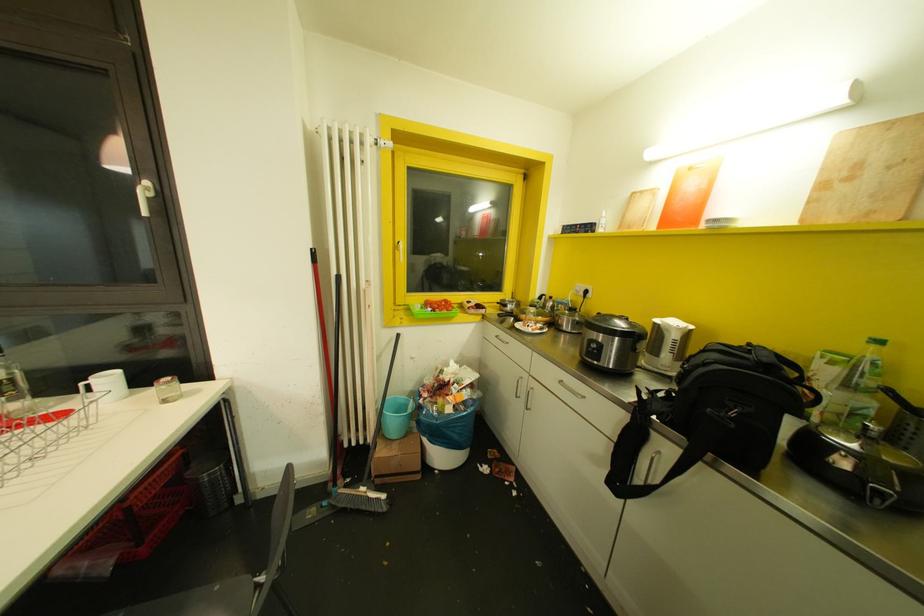
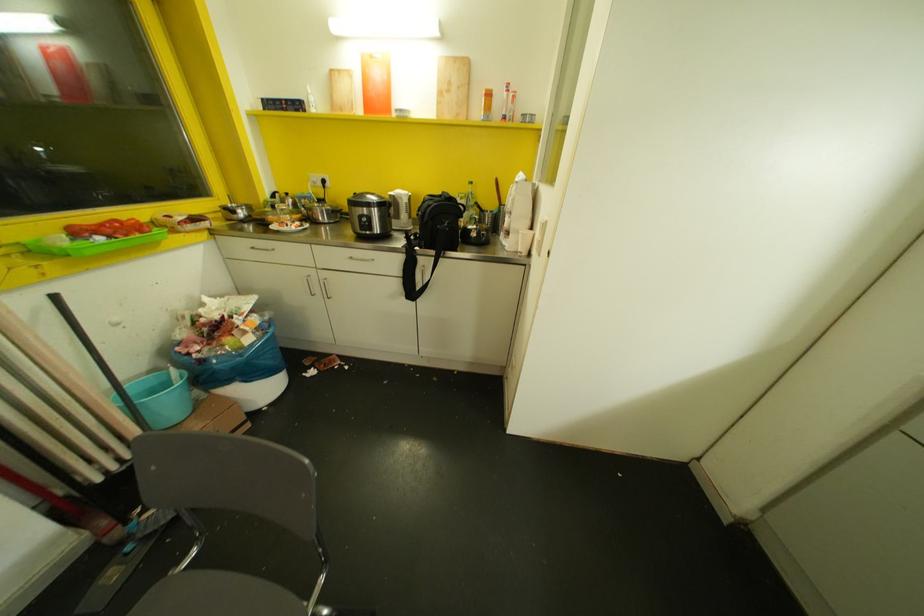
Where in the second image is the point corresponding to point 732,413 from the first image?

(445, 224)